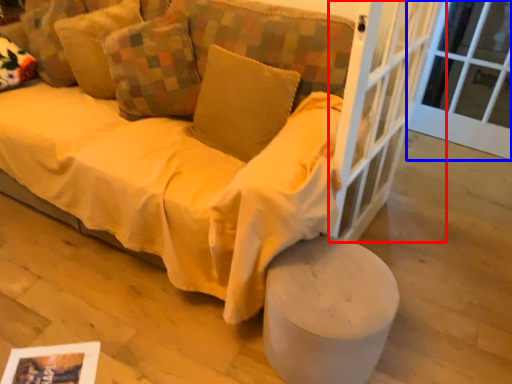
Question: Which of the following is the farthest to the observer, screen door (highlighted by a red box) or window frame (highlighted by a blue box)?

Choices:
 (A) screen door
 (B) window frame

Answer: (B)